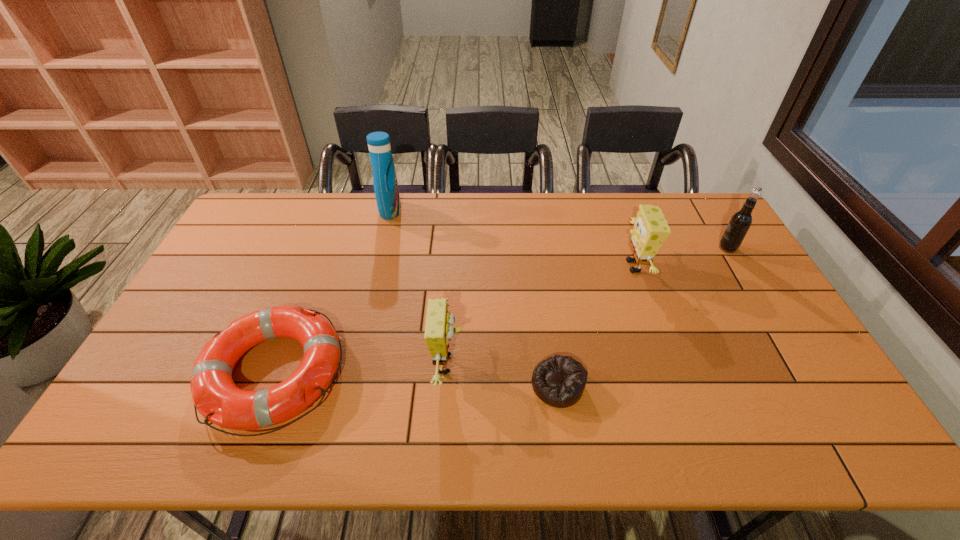
The width and height of the screenshot is (960, 540). Identify the location of detergent. (385, 183).

Where is `the tallest object`? This screenshot has height=540, width=960. the tallest object is located at coordinates (385, 183).

Find the location of a particular element. The image size is (960, 540). root beer is located at coordinates (741, 221).

Where is `the second object from right to left`? The image size is (960, 540). the second object from right to left is located at coordinates (651, 229).

Locate an element on the screen. The width and height of the screenshot is (960, 540). the farther sponge is located at coordinates (651, 229).

Find the location of `the nearer sponge`. the nearer sponge is located at coordinates (439, 330).

Where is `the left sponge`? the left sponge is located at coordinates (439, 330).

Image resolution: width=960 pixels, height=540 pixels. In order to click on the second shortest object in this screenshot , I will do `click(216, 397)`.

Find the location of a particular element. The width and height of the screenshot is (960, 540). the shortest object is located at coordinates (559, 381).

Identify the location of the third object from right to left. The image size is (960, 540). (559, 381).